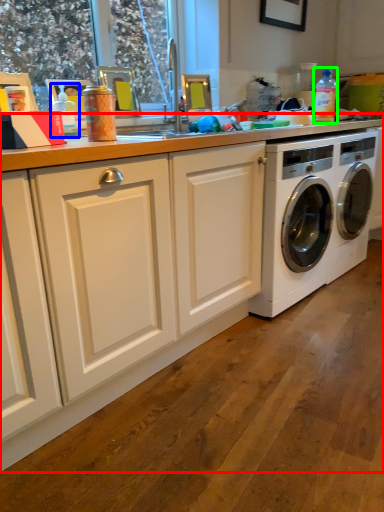
Question: Which is nearer to the countertop (highlighted by a red box)? bottle (highlighted by a blue box) or bottle (highlighted by a green box).

Choices:
 (A) bottle
 (B) bottle

Answer: (A)